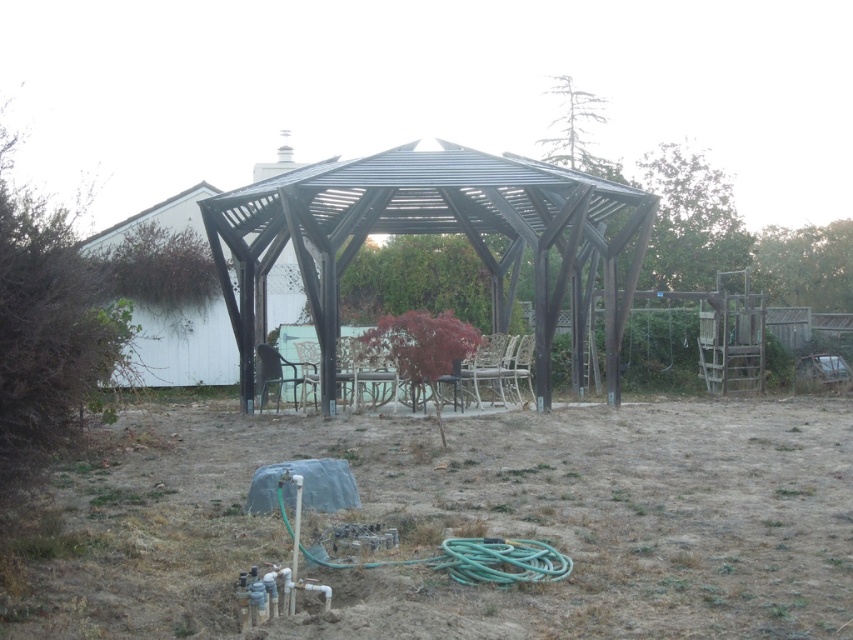
Can you confirm if white plastic chair at center is shorter than metallic gray chair at center?

No, white plastic chair at center is not shorter than metallic gray chair at center.

Is white plastic chair at center wider than metallic gray chair at center?

Incorrect, white plastic chair at center's width does not surpass metallic gray chair at center's.

At what (x,y) coordinates should I click in order to perform the action: click on white plastic chair at center. Please return your answer as a coordinate pair (x, y). Looking at the image, I should click on (485, 365).

Does matte black pergola at left have a lesser height compared to green rubber garden hose at lower center?

In fact, matte black pergola at left may be taller than green rubber garden hose at lower center.

Can you confirm if matte black pergola at left is smaller than green rubber garden hose at lower center?

No.

Which is behind, point (173, 328) or point (514, 548)?

The point (173, 328) is more distant.

Identify the location of matte black pergola at left. (183, 346).

Does brown dry soil at center come behind metallic gray chair at center?

No, brown dry soil at center is in front of metallic gray chair at center.

Consider the image. Who is more distant from viewer, (613, 440) or (258, 392)?

The point (258, 392) is more distant.

The image size is (853, 640). I want to click on brown dry soil at center, so click(x=473, y=524).